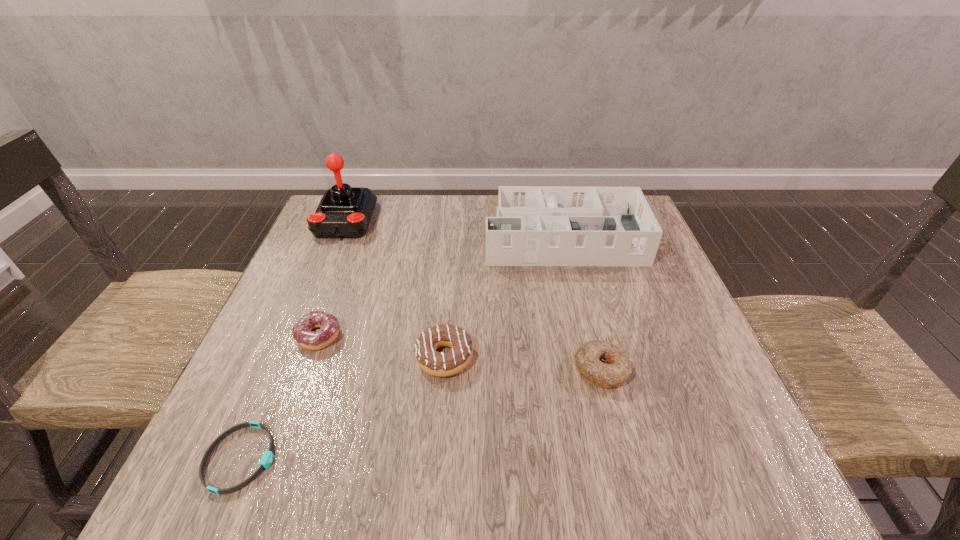
Where is `free space that satisfies the following two spatial constraints: 1. on the base of the tallest object; 2. on the buckle of the shortest object`? This screenshot has width=960, height=540. free space that satisfies the following two spatial constraints: 1. on the base of the tallest object; 2. on the buckle of the shortest object is located at coordinates (248, 458).

Locate an element on the screen. The width and height of the screenshot is (960, 540). blank area in the image that satisfies the following two spatial constraints: 1. on the base of the rightmost doughnut; 2. on the right side of the tallest object is located at coordinates (284, 370).